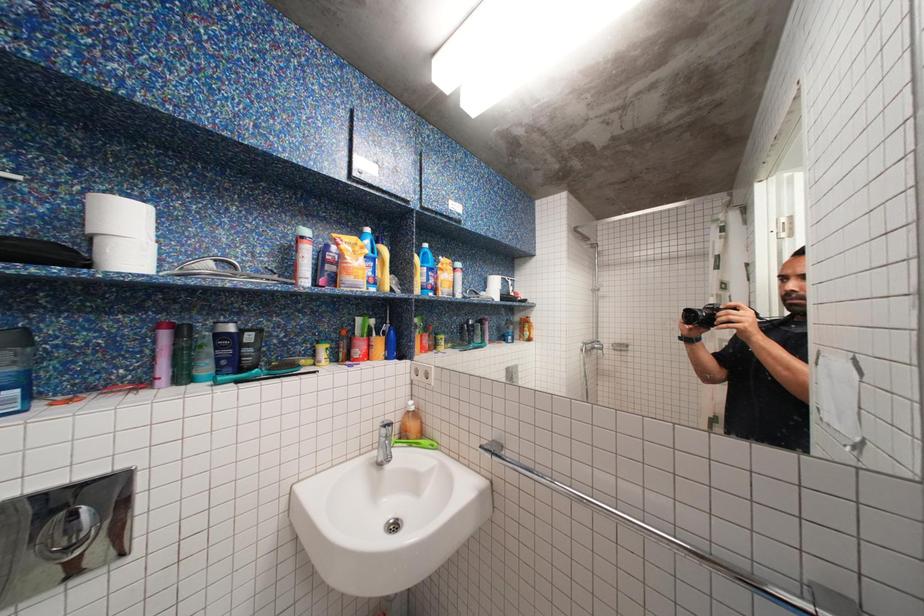
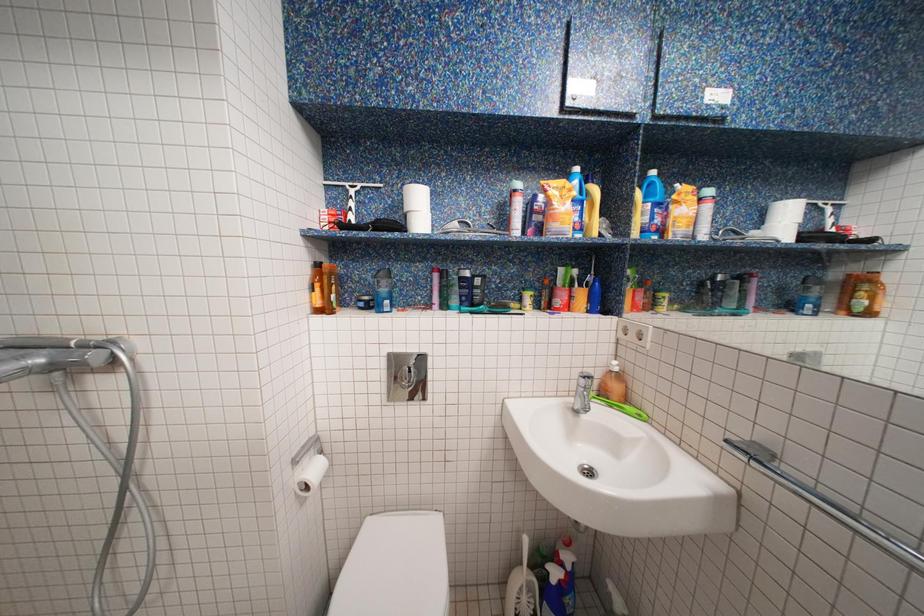
Question: The images are taken continuously from a first-person perspective. In which direction is your viewpoint rotating?

Choices:
 (A) Left
 (B) Right
 (C) Up
 (D) Down

Answer: (A)